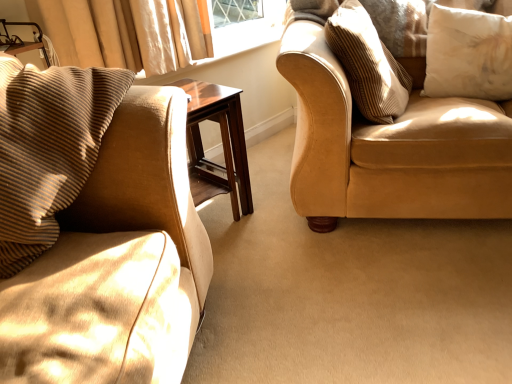
Image resolution: width=512 pixels, height=384 pixels. I want to click on vacant area that is in front of mahogany wood side table at center, so point(239,248).